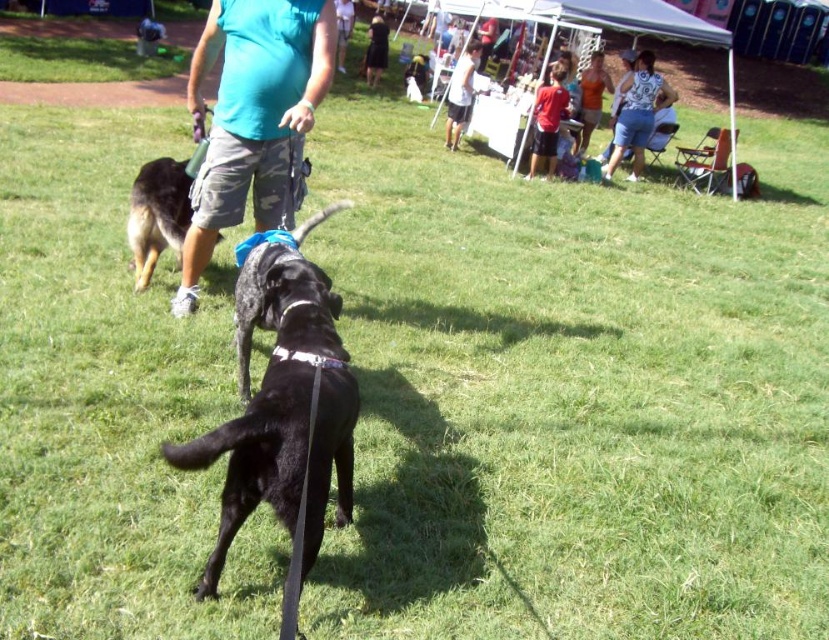
Question: Among these objects, which one is nearest to the camera?

Choices:
 (A) black smooth dog at center
 (B) white cotton dress at upper right
 (C) purple fabric neckband at center
 (D) black matte dog at center

Answer: (D)

Question: Is black matte dog at center wider than white cotton dress at upper right?

Choices:
 (A) yes
 (B) no

Answer: (B)

Question: Does teal fabric shirt at center lie behind purple fabric neckband at center?

Choices:
 (A) yes
 (B) no

Answer: (A)

Question: Is teal fabric shirt at center to the left of purple fabric neckband at center from the viewer's perspective?

Choices:
 (A) no
 (B) yes

Answer: (B)

Question: Estimate the real-world distances between objects in this image. Which object is farther from the purple fabric neckband at center?

Choices:
 (A) black matte dog at center
 (B) black smooth dog at center
 (C) black dress at center

Answer: (C)

Question: Which is farther from the black matte dog at center?

Choices:
 (A) teal fabric shirt at center
 (B) black smooth dog at center
 (C) black fur dog at center
 (D) purple fabric neckband at center

Answer: (C)